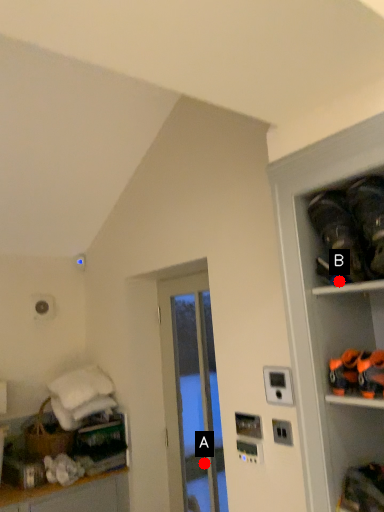
Question: Two points are circled on the image, labeled by A and B beside each circle. Which point is closer to the camera taking this photo?

Choices:
 (A) A is closer
 (B) B is closer

Answer: (B)